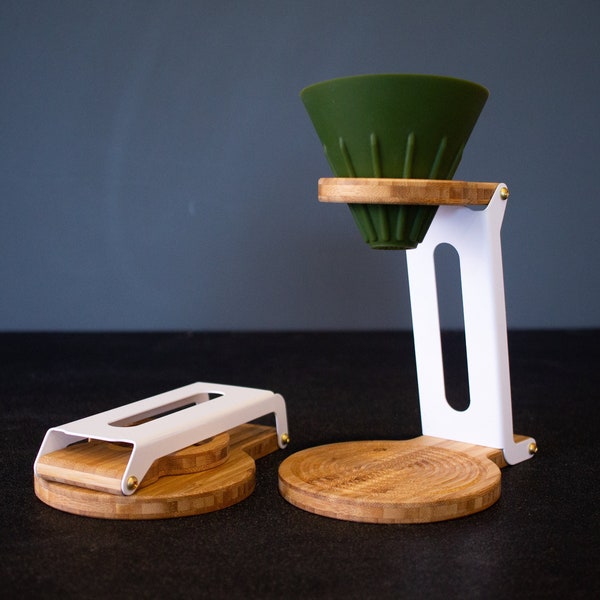
At what (x,y) coordinates should I click in order to perform the action: click on wall. Please return your answer as a coordinate pair (x, y). The width and height of the screenshot is (600, 600). Looking at the image, I should click on (248, 157).